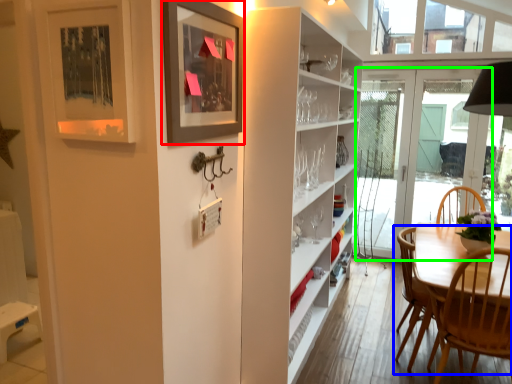
Question: Based on their relative distances, which object is farther from picture frame (highlighted by a red box)? Choose from chair (highlighted by a blue box) and door (highlighted by a green box).

Choices:
 (A) chair
 (B) door

Answer: (B)